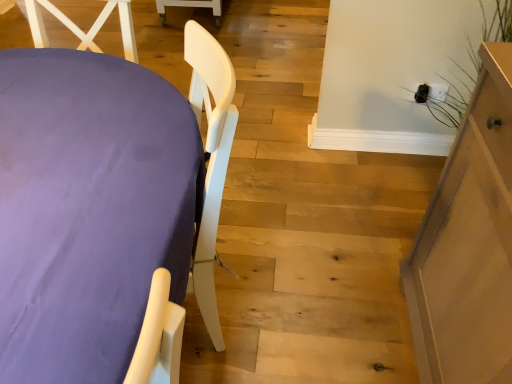
Question: Is purple fabric-covered table at left, arranged as the 1th furniture when viewed from the left, in front of or behind light brown wooden cabinet at right, which ranks as the second furniture in left-to-right order, in the image?

Choices:
 (A) behind
 (B) front

Answer: (B)

Question: Is purple fabric-covered table at left, arranged as the 1th furniture when viewed from the left, taller or shorter than light brown wooden cabinet at right, acting as the first furniture starting from the right?

Choices:
 (A) tall
 (B) short

Answer: (B)

Question: From a real-world perspective, is purple fabric-covered table at left, arranged as the 1th furniture when viewed from the left, positioned above or below light brown wooden cabinet at right, acting as the first furniture starting from the right?

Choices:
 (A) below
 (B) above

Answer: (A)

Question: Considering the positions of light brown wooden cabinet at right, acting as the first furniture starting from the right, and purple fabric-covered table at left, which ranks as the 2th furniture in right-to-left order, in the image, is light brown wooden cabinet at right, acting as the first furniture starting from the right, bigger or smaller than purple fabric-covered table at left, which ranks as the 2th furniture in right-to-left order,?

Choices:
 (A) small
 (B) big

Answer: (A)

Question: Which is correct: light brown wooden cabinet at right, acting as the first furniture starting from the right, is inside purple fabric-covered table at left, arranged as the 1th furniture when viewed from the left, or outside of it?

Choices:
 (A) inside
 (B) outside

Answer: (B)

Question: From a real-world perspective, is light brown wooden cabinet at right, acting as the first furniture starting from the right, positioned above or below purple fabric-covered table at left, arranged as the 1th furniture when viewed from the left?

Choices:
 (A) below
 (B) above

Answer: (B)

Question: Visually, is light brown wooden cabinet at right, which ranks as the second furniture in left-to-right order, positioned to the left or to the right of purple fabric-covered table at left, which ranks as the 2th furniture in right-to-left order?

Choices:
 (A) right
 (B) left

Answer: (A)